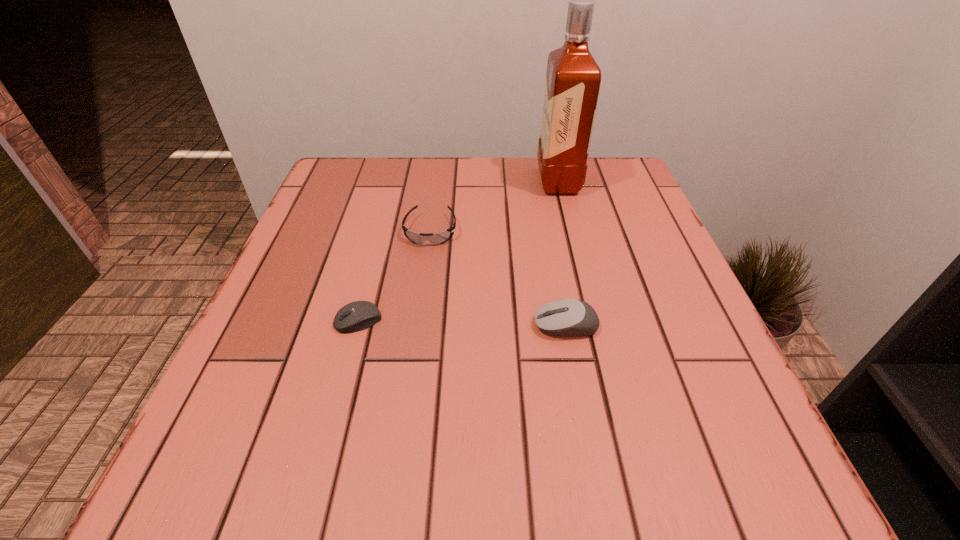
Find the location of a particular element. This screenshot has width=960, height=540. the farthest object is located at coordinates (573, 78).

The image size is (960, 540). I want to click on the tallest object, so click(x=573, y=78).

The width and height of the screenshot is (960, 540). What are the coordinates of `the right computer equipment` in the screenshot? It's located at (567, 317).

Image resolution: width=960 pixels, height=540 pixels. I want to click on the second tallest object, so click(x=567, y=317).

What are the coordinates of `the third tallest object` in the screenshot? It's located at (438, 238).

I want to click on sunglasses, so click(438, 238).

What are the coordinates of `the left computer equipment` in the screenshot? It's located at (359, 315).

Where is `the shortest object`? This screenshot has height=540, width=960. the shortest object is located at coordinates (359, 315).

Identify the location of vacant area situated 0.270m on the front label of the tallest object. The image size is (960, 540). (429, 181).

In order to click on vacant space located on the front label of the tallest object in this screenshot , I will do `click(486, 181)`.